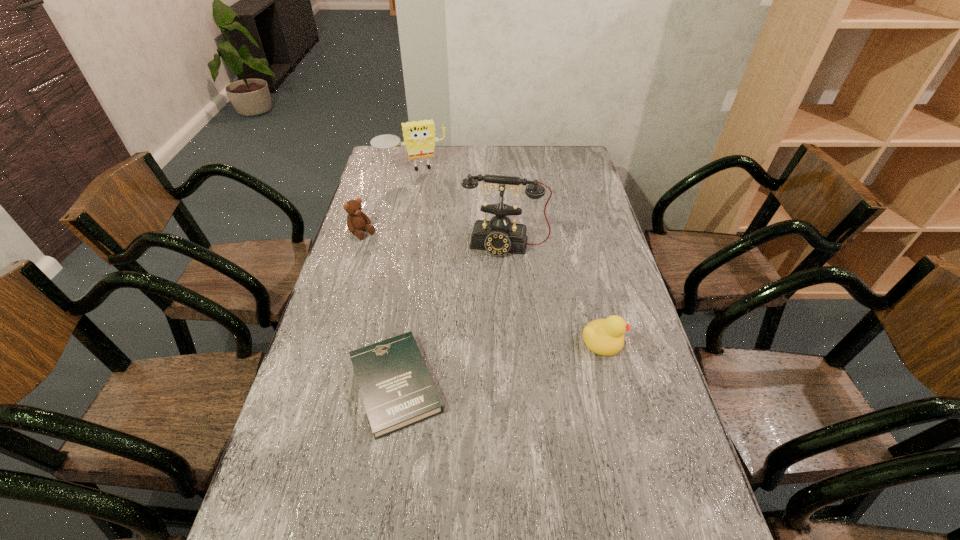
You are a GUI agent. You are given a task and a screenshot of the screen. Output one action in this format:
    pyautogui.click(x=<x>, y=<y>)
    Task: Click on the shortest object
    The image size is (960, 540).
    Given the screenshot: What is the action you would take?
    pyautogui.click(x=397, y=389)

Identify the location of the rightmost object. (604, 337).

Identify the location of duckling. (604, 337).

The image size is (960, 540). In order to click on the third tallest object in this screenshot , I will do `click(356, 220)`.

The image size is (960, 540). What are the coordinates of `the fourth shortest object` in the screenshot? It's located at (419, 137).

What are the coordinates of `the farthest object` in the screenshot? It's located at (419, 137).

What are the coordinates of `telephone` in the screenshot? It's located at (499, 236).

Find the location of a particular element. the tallest object is located at coordinates (499, 236).

I want to click on free location located 0.060m on the front of the shortest object, so click(383, 467).

Locate an element on the screen. This screenshot has width=960, height=540. vacant space located on the face of the teddy bear is located at coordinates (403, 266).